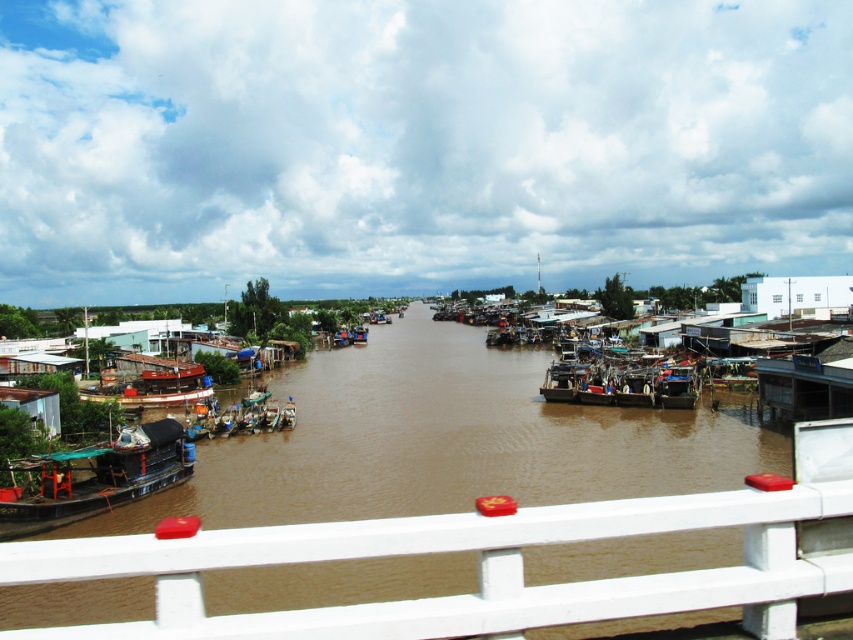
You are standing on the bridge overlooking the river and need to locate the brown matte river at center. According to the coordinates provided, where exactly is it positioned?

The brown matte river at center is located at point coordinates of 0.689 on the x axis and 0.522 on the y axis.

You are standing on the bridge overlooking the river and see the green matte boat at lower left. If you want to throw a small object to someone on that boat, is the distance too far for an average person to reach?

The distance between you and the green matte boat at lower left is 26.51 meters. An average person can throw an object about 20 to 30 meters, so it might be possible but challenging.

You are standing on the bridge overlooking the river and notice the green matte boat at lower left and the wooden boat at center. Which boat is closer to the bridge where you are standing?

The green matte boat at lower left is closer to the bridge because it is positioned under the wooden boat at center, indicating it is lower in elevation and thus nearer to the observer on the bridge.